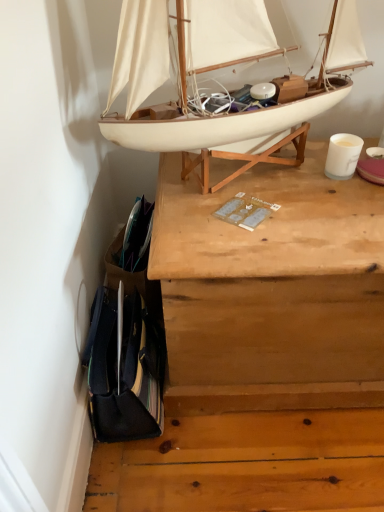
Question: Is wooden chest at upper center wider or thinner than white matte boat at upper center?

Choices:
 (A) wide
 (B) thin

Answer: (A)

Question: Considering the relative positions of wooden chest at upper center and white matte boat at upper center in the image provided, is wooden chest at upper center to the left or to the right of white matte boat at upper center?

Choices:
 (A) left
 (B) right

Answer: (B)

Question: Considering their positions, is wooden chest at upper center located in front of or behind white matte boat at upper center?

Choices:
 (A) behind
 (B) front

Answer: (A)

Question: From their relative heights in the image, would you say white matte boat at upper center is taller or shorter than wooden chest at upper center?

Choices:
 (A) short
 (B) tall

Answer: (A)

Question: Relative to wooden chest at upper center, is white matte boat at upper center in front or behind?

Choices:
 (A) behind
 (B) front

Answer: (B)

Question: From a real-world perspective, is white matte boat at upper center positioned above or below wooden chest at upper center?

Choices:
 (A) below
 (B) above

Answer: (B)

Question: Looking at the image, does white matte boat at upper center seem bigger or smaller compared to wooden chest at upper center?

Choices:
 (A) big
 (B) small

Answer: (B)